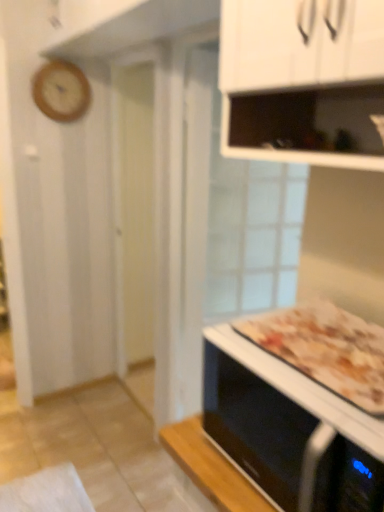
This screenshot has height=512, width=384. Find the location of `black glossy microwave oven at lower right`. black glossy microwave oven at lower right is located at coordinates (291, 417).

The width and height of the screenshot is (384, 512). I want to click on black glossy microwave oven at lower right, so click(x=291, y=417).

Choose the correct answer: Is wooden clock at upper left inside black glossy microwave oven at lower right or outside it?

wooden clock at upper left exists outside the volume of black glossy microwave oven at lower right.

Which of these two, wooden clock at upper left or black glossy microwave oven at lower right, is bigger?

Bigger between the two is black glossy microwave oven at lower right.

Which is in front, point (71, 108) or point (256, 343)?

The point (256, 343) is more forward.

Can you tell me how much black glossy microwave oven at lower right and wooden clock at upper left differ in facing direction?

black glossy microwave oven at lower right and wooden clock at upper left are facing 90.6 degrees away from each other.

Can you confirm if black glossy microwave oven at lower right is taller than wooden clock at upper left?

Incorrect, the height of black glossy microwave oven at lower right is not larger of that of wooden clock at upper left.

Considering the relative sizes of black glossy microwave oven at lower right and wooden clock at upper left in the image provided, is black glossy microwave oven at lower right bigger than wooden clock at upper left?

Indeed, black glossy microwave oven at lower right has a larger size compared to wooden clock at upper left.

Is black glossy microwave oven at lower right to the left or to the right of wooden clock at upper left in the image?

black glossy microwave oven at lower right is positioned on wooden clock at upper left's right side.

From the picture: From the image's perspective, which is below, golden brown crusty pizza at lower right or wooden clock at upper left?

golden brown crusty pizza at lower right.

From a real-world perspective, who is located higher, golden brown crusty pizza at lower right or wooden clock at upper left?

wooden clock at upper left.

Is golden brown crusty pizza at lower right looking in the opposite direction of wooden clock at upper left?

No, golden brown crusty pizza at lower right is not facing the opposite direction of wooden clock at upper left.

Between golden brown crusty pizza at lower right and wooden clock at upper left, which one appears on the right side from the viewer's perspective?

Positioned to the right is golden brown crusty pizza at lower right.

From the image's perspective, which is above, golden brown crusty pizza at lower right or black glossy microwave oven at lower right?

golden brown crusty pizza at lower right.

Between golden brown crusty pizza at lower right and black glossy microwave oven at lower right, which one is positioned in front?

black glossy microwave oven at lower right is in front.

How much distance is there between golden brown crusty pizza at lower right and black glossy microwave oven at lower right?

The distance of golden brown crusty pizza at lower right from black glossy microwave oven at lower right is 2.84 inches.

Between golden brown crusty pizza at lower right and black glossy microwave oven at lower right, which one has smaller size?

golden brown crusty pizza at lower right.

From the picture: Does black glossy microwave oven at lower right appear on the left side of golden brown crusty pizza at lower right?

Yes, black glossy microwave oven at lower right is to the left of golden brown crusty pizza at lower right.

From the image's perspective, is black glossy microwave oven at lower right located above or below golden brown crusty pizza at lower right?

black glossy microwave oven at lower right is situated lower than golden brown crusty pizza at lower right in the image.

From a real-world perspective, is black glossy microwave oven at lower right physically above golden brown crusty pizza at lower right?

Actually, black glossy microwave oven at lower right is physically below golden brown crusty pizza at lower right in the real world.

Based on the photo, considering the relative sizes of black glossy microwave oven at lower right and golden brown crusty pizza at lower right in the image provided, is black glossy microwave oven at lower right smaller than golden brown crusty pizza at lower right?

Actually, black glossy microwave oven at lower right might be larger than golden brown crusty pizza at lower right.

Locate an element on the screen. This screenshot has height=512, width=384. pizza that appears below the wooden clock at upper left (from a real-world perspective) is located at coordinates (326, 349).

Is wooden clock at upper left in contact with golden brown crusty pizza at lower right?

There is a gap between wooden clock at upper left and golden brown crusty pizza at lower right.

Is wooden clock at upper left surrounding golden brown crusty pizza at lower right?

No.

Which is behind, wooden clock at upper left or golden brown crusty pizza at lower right?

Positioned behind is wooden clock at upper left.

The height and width of the screenshot is (512, 384). In order to click on microwave oven located in front of the wooden clock at upper left in this screenshot , I will do `click(291, 417)`.

What are the coordinates of `microwave oven directly beneath the wooden clock at upper left (from a real-world perspective)` in the screenshot? It's located at (291, 417).

Looking at the image, which one is located closer to black glossy microwave oven at lower right, golden brown crusty pizza at lower right or wooden clock at upper left?

golden brown crusty pizza at lower right lies closer to black glossy microwave oven at lower right than the other object.

Looking at the image, which one is located closer to golden brown crusty pizza at lower right, black glossy microwave oven at lower right or wooden clock at upper left?

Among the two, black glossy microwave oven at lower right is located nearer to golden brown crusty pizza at lower right.

From the image, which object appears to be farther from wooden clock at upper left, black glossy microwave oven at lower right or golden brown crusty pizza at lower right?

black glossy microwave oven at lower right.

Which object lies further to the anchor point golden brown crusty pizza at lower right, wooden clock at upper left or black glossy microwave oven at lower right?

wooden clock at upper left is further to golden brown crusty pizza at lower right.

Considering their positions, is wooden clock at upper left positioned closer to black glossy microwave oven at lower right than golden brown crusty pizza at lower right?

Based on the image, golden brown crusty pizza at lower right appears to be nearer to black glossy microwave oven at lower right.

Looking at the image, which one is located further to wooden clock at upper left, golden brown crusty pizza at lower right or black glossy microwave oven at lower right?

black glossy microwave oven at lower right is further to wooden clock at upper left.

Where is `pizza between black glossy microwave oven at lower right and wooden clock at upper left in the front-back direction`? pizza between black glossy microwave oven at lower right and wooden clock at upper left in the front-back direction is located at coordinates (326, 349).